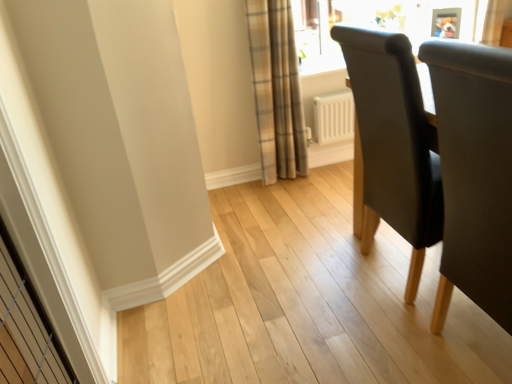
I want to click on free space that is to the left of dark gray fabric chair at right, which is the 1th chair from back to front, so click(x=323, y=297).